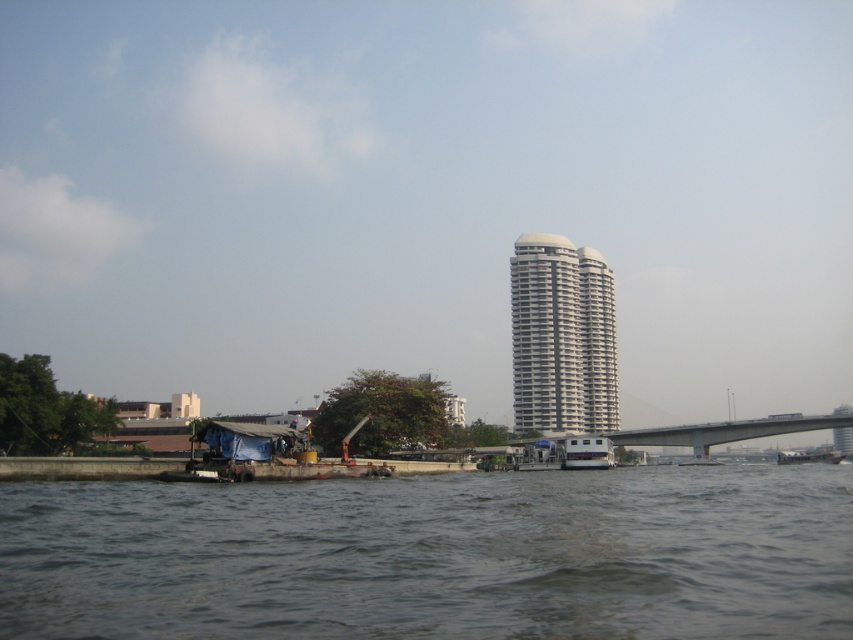
Looking at this image, is concrete gray bridge at center right bigger than white plastic boat at center?

Yes.

Describe the element at coordinates (726, 432) in the screenshot. I see `concrete gray bridge at center right` at that location.

Which is in front, point (849, 419) or point (585, 436)?

Point (585, 436) is more forward.

This screenshot has width=853, height=640. Identify the location of concrete gray bridge at center right. (726, 432).

Identify the location of dark gray water at lower center. The image size is (853, 640). (434, 556).

Can you confirm if dark gray water at lower center is positioned above white plastic boat at center?

Correct, dark gray water at lower center is located above white plastic boat at center.

Between point (273, 588) and point (569, 468), which one is positioned behind?

The point (569, 468) is behind.

Image resolution: width=853 pixels, height=640 pixels. Find the location of `dark gray water at lower center`. dark gray water at lower center is located at coordinates 434,556.

Which is above, dark gray water at lower center or concrete gray bridge at center right?

dark gray water at lower center is higher up.

Does dark gray water at lower center come behind concrete gray bridge at center right?

No.

Where is `dark gray water at lower center`? The height and width of the screenshot is (640, 853). dark gray water at lower center is located at coordinates (434, 556).